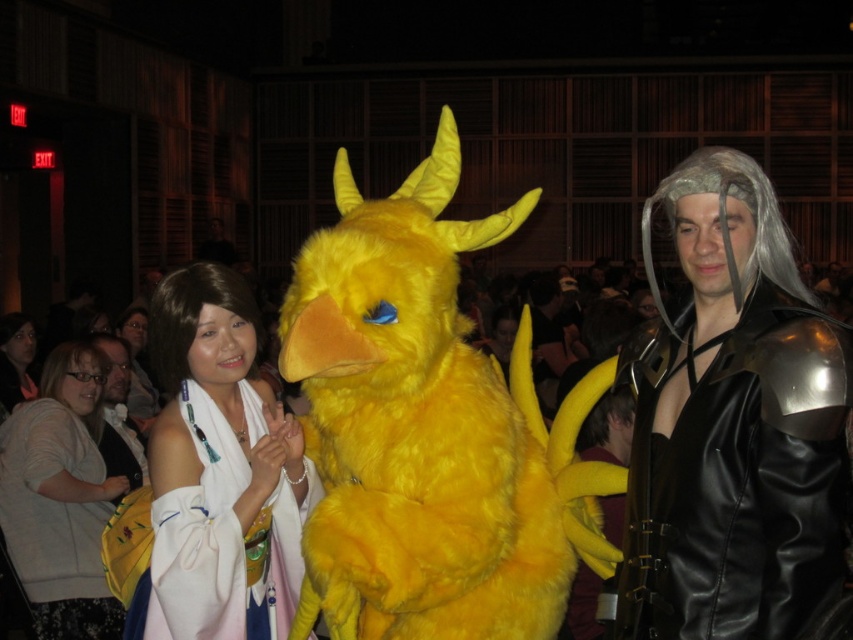
Question: Which point appears closest to the camera in this image?

Choices:
 (A) (315, 276)
 (B) (109, 344)

Answer: (A)

Question: Among these points, which one is farthest from the camera?

Choices:
 (A) (730, 392)
 (B) (769, 232)
 (C) (253, 330)

Answer: (C)

Question: Which point is closer to the camera taking this photo?

Choices:
 (A) (47, 392)
 (B) (173, 392)
 (C) (129, 460)
 (D) (26, 376)

Answer: (B)

Question: Can you confirm if fluffy yellow dragon at center is positioned to the right of brown synthetic wig at center?

Choices:
 (A) no
 (B) yes

Answer: (B)

Question: Is brown synthetic wig at center thinner than brown synthetic wig at lower left?

Choices:
 (A) yes
 (B) no

Answer: (A)

Question: Can you confirm if shiny silver armor at right is bigger than matte black wig at left?

Choices:
 (A) no
 (B) yes

Answer: (A)